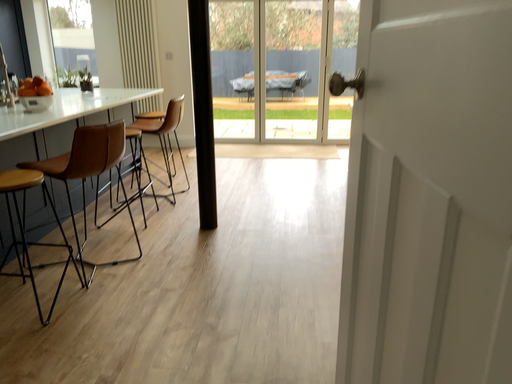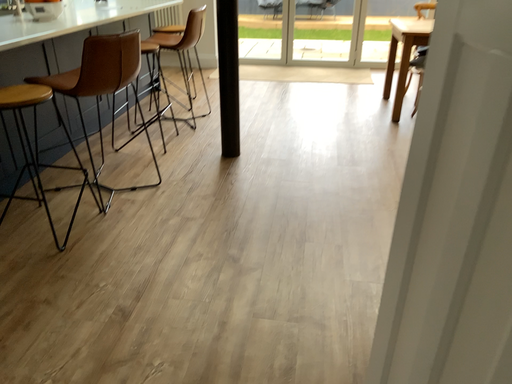
Question: How did the camera likely rotate when shooting the video?

Choices:
 (A) rotated downward
 (B) rotated upward

Answer: (A)